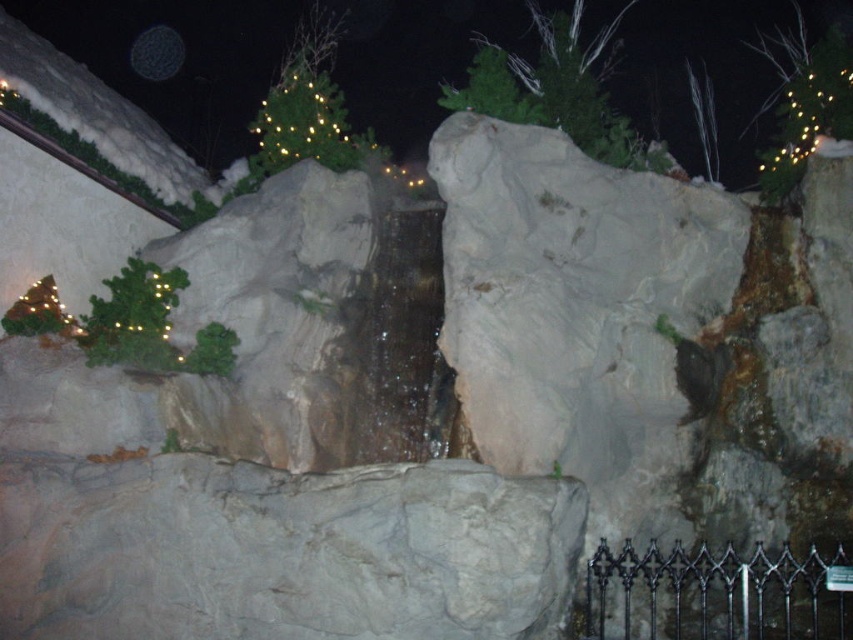
Between green matte tree at upper center and illuminated wire at upper right, which one is positioned lower?

Positioned lower is illuminated wire at upper right.

Between green matte tree at upper center and illuminated wire at upper right, which one appears on the right side from the viewer's perspective?

From the viewer's perspective, illuminated wire at upper right appears more on the right side.

Describe the element at coordinates (558, 90) in the screenshot. I see `green matte tree at upper center` at that location.

Where is `green matte tree at upper center`? The image size is (853, 640). green matte tree at upper center is located at coordinates (558, 90).

Is point (581, 132) positioned behind point (276, 140)?

No, (581, 132) is closer to viewer.

Can you confirm if green matte tree at upper center is taller than green matte christmas tree at upper center?

No.

Is point (633, 140) positioned before point (305, 29)?

That is True.

Locate an element on the screen. The width and height of the screenshot is (853, 640). green matte tree at upper center is located at coordinates (558, 90).

Who is lower down, green matte christmas tree at upper center or illuminated wire at upper right?

Positioned lower is illuminated wire at upper right.

What do you see at coordinates (305, 108) in the screenshot? Image resolution: width=853 pixels, height=640 pixels. I see `green matte christmas tree at upper center` at bounding box center [305, 108].

Who is more distant from viewer, (x=366, y=141) or (x=773, y=100)?

The point (x=773, y=100) is more distant.

Where is `green matte christmas tree at upper center`? Image resolution: width=853 pixels, height=640 pixels. green matte christmas tree at upper center is located at coordinates (305, 108).